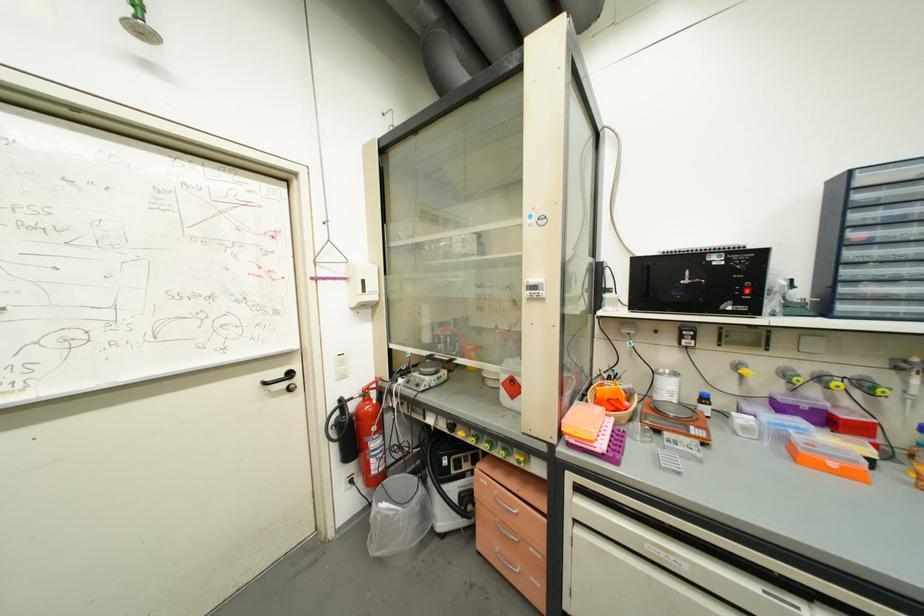
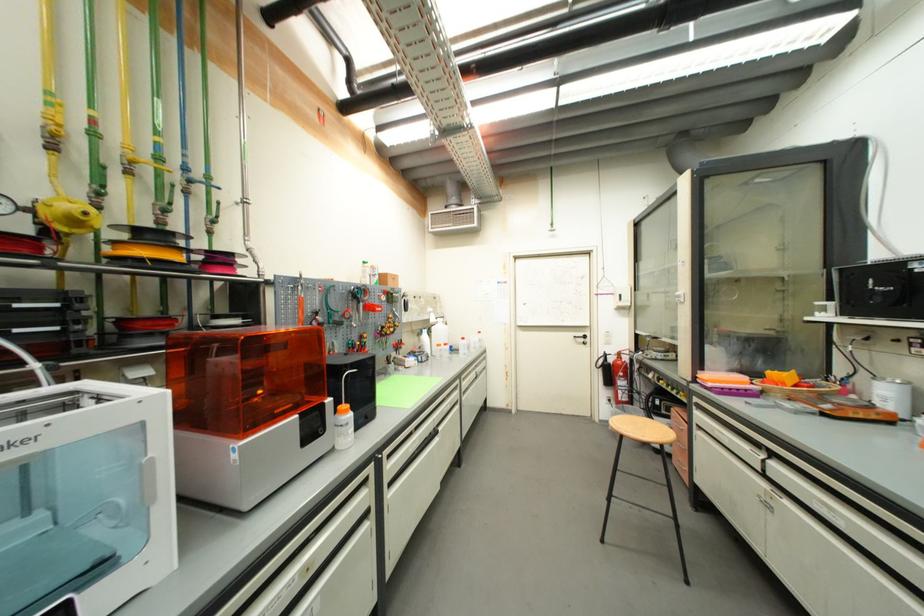
Find the pixel in the second image that matches (x=565, y=437) in the first image.

(699, 379)